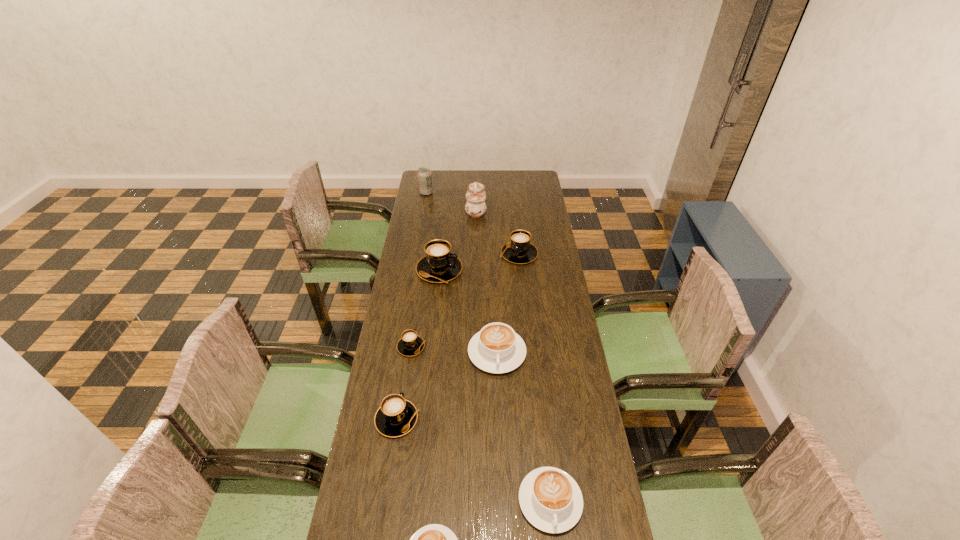
What are the coordinates of `vacant space that is in between the third farthest black cappuccino and the biggest black cappuccino` in the screenshot? It's located at (425, 308).

Where is `object that is the second closest to the second biggest white cappuccino`? This screenshot has height=540, width=960. object that is the second closest to the second biggest white cappuccino is located at coordinates (396, 416).

Identify which object is located as the fourth nearest to the second biggest white cappuccino. Please provide its 2D coordinates. Your answer should be formatted as a tuple, i.e. [(x, y)], where the tuple contains the x and y coordinates of a point satisfying the conditions above.

[(410, 344)]

Identify which cappuccino is the fourth closest to the rightmost black cappuccino. Please provide its 2D coordinates. Your answer should be formatted as a tuple, i.e. [(x, y)], where the tuple contains the x and y coordinates of a point satisfying the conditions above.

[(396, 416)]

You are a GUI agent. You are given a task and a screenshot of the screen. Output one action in this format:
    pyautogui.click(x=<x>, y=<y>)
    Task: Click on the cappuccino that is the fifth closest to the second biggest white cappuccino
    The image size is (960, 540).
    Given the screenshot: What is the action you would take?
    pyautogui.click(x=439, y=265)

At what (x,y) coordinates should I click in order to perform the action: click on black cappuccino that is the second closest to the third farthest black cappuccino. Please return your answer as a coordinate pair (x, y). The height and width of the screenshot is (540, 960). Looking at the image, I should click on (439, 265).

What are the coordinates of `black cappuccino that stands as the closest to the eighth nearest object` in the screenshot? It's located at (519, 250).

At what (x,y) coordinates should I click in order to perform the action: click on the third closest white cappuccino to the third smallest black cappuccino. Please return your answer as a coordinate pair (x, y). Looking at the image, I should click on (434, 539).

Identify which white cappuccino is located as the nearest to the third smallest black cappuccino. Please provide its 2D coordinates. Your answer should be formatted as a tuple, i.e. [(x, y)], where the tuple contains the x and y coordinates of a point satisfying the conditions above.

[(496, 348)]

Find the location of a particular element. The height and width of the screenshot is (540, 960). vacant space that satisfies the following two spatial constraints: 1. on the front side of the soda can; 2. on the left side of the biggest black cappuccino is located at coordinates (413, 270).